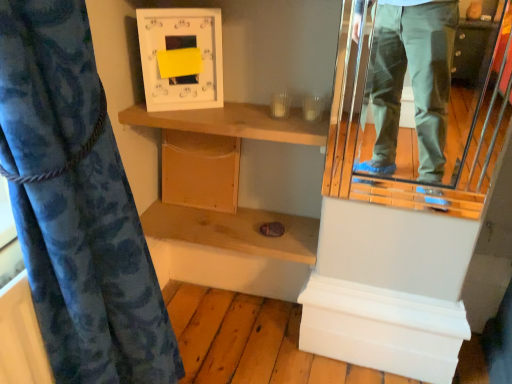
Question: Is wooden shelf at center, acting as the second shelf starting from the top, facing towards wooden shelf at upper center, acting as the 2th shelf starting from the bottom?

Choices:
 (A) yes
 (B) no

Answer: (B)

Question: From a real-world perspective, does wooden shelf at center, acting as the second shelf starting from the top, stand above wooden shelf at upper center, positioned as the first shelf in top-to-bottom order?

Choices:
 (A) no
 (B) yes

Answer: (A)

Question: Is wooden shelf at center, acting as the second shelf starting from the top, positioned with its back to wooden shelf at upper center, positioned as the first shelf in top-to-bottom order?

Choices:
 (A) no
 (B) yes

Answer: (A)

Question: From a real-world perspective, is wooden shelf at center, placed as the first shelf when sorted from bottom to top, physically below wooden shelf at upper center, positioned as the first shelf in top-to-bottom order?

Choices:
 (A) yes
 (B) no

Answer: (A)

Question: Is wooden shelf at center, placed as the first shelf when sorted from bottom to top, completely or partially outside of wooden shelf at upper center, positioned as the first shelf in top-to-bottom order?

Choices:
 (A) no
 (B) yes

Answer: (B)

Question: From the image's perspective, is wooden shelf at center, placed as the first shelf when sorted from bottom to top, over wooden shelf at upper center, acting as the 2th shelf starting from the bottom?

Choices:
 (A) yes
 (B) no

Answer: (B)

Question: From the image's perspective, is blue floral fabric at left below wooden shelf at upper center, positioned as the first shelf in top-to-bottom order?

Choices:
 (A) yes
 (B) no

Answer: (A)

Question: Considering the relative sizes of blue floral fabric at left and wooden shelf at upper center, acting as the 2th shelf starting from the bottom, in the image provided, is blue floral fabric at left wider than wooden shelf at upper center, acting as the 2th shelf starting from the bottom,?

Choices:
 (A) no
 (B) yes

Answer: (B)

Question: Is blue floral fabric at left oriented away from wooden shelf at upper center, acting as the 2th shelf starting from the bottom?

Choices:
 (A) yes
 (B) no

Answer: (B)

Question: Could you tell me if blue floral fabric at left is facing wooden shelf at upper center, acting as the 2th shelf starting from the bottom?

Choices:
 (A) no
 (B) yes

Answer: (A)

Question: From a real-world perspective, is blue floral fabric at left positioned over wooden shelf at upper center, acting as the 2th shelf starting from the bottom, based on gravity?

Choices:
 (A) no
 (B) yes

Answer: (A)

Question: Does blue floral fabric at left have a larger size compared to wooden shelf at upper center, positioned as the first shelf in top-to-bottom order?

Choices:
 (A) yes
 (B) no

Answer: (A)

Question: From the image's perspective, is blue floral fabric at left below metallic reflective mirror at right?

Choices:
 (A) no
 (B) yes

Answer: (B)